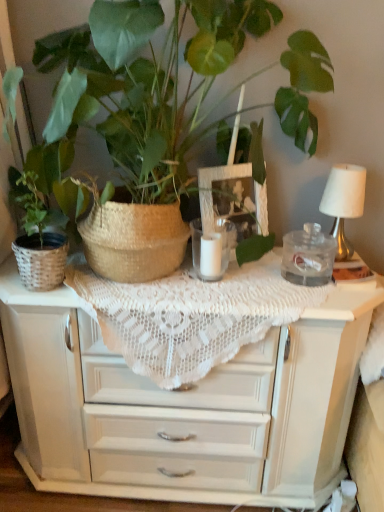
In order to click on free space that is to the left of white glass candle at center in this screenshot , I will do `click(150, 280)`.